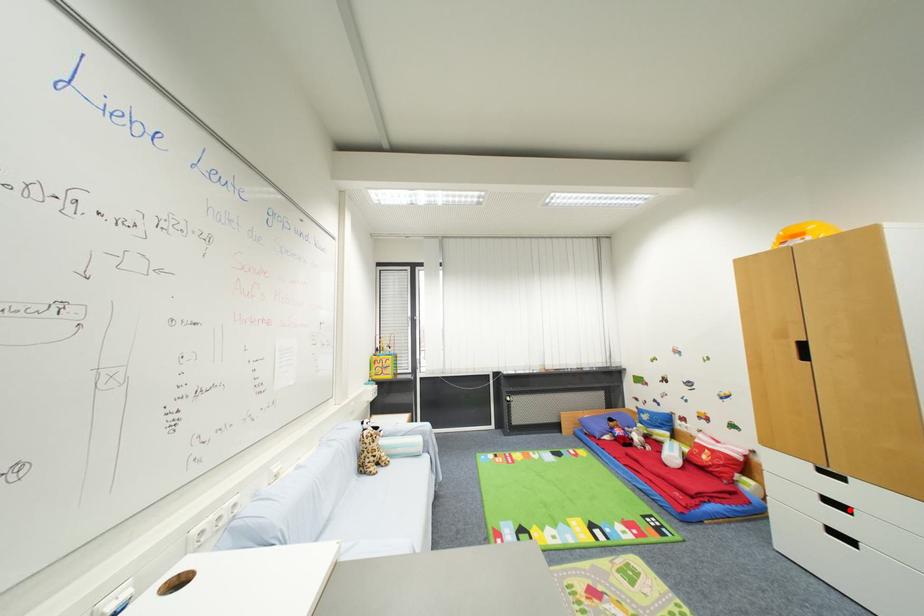
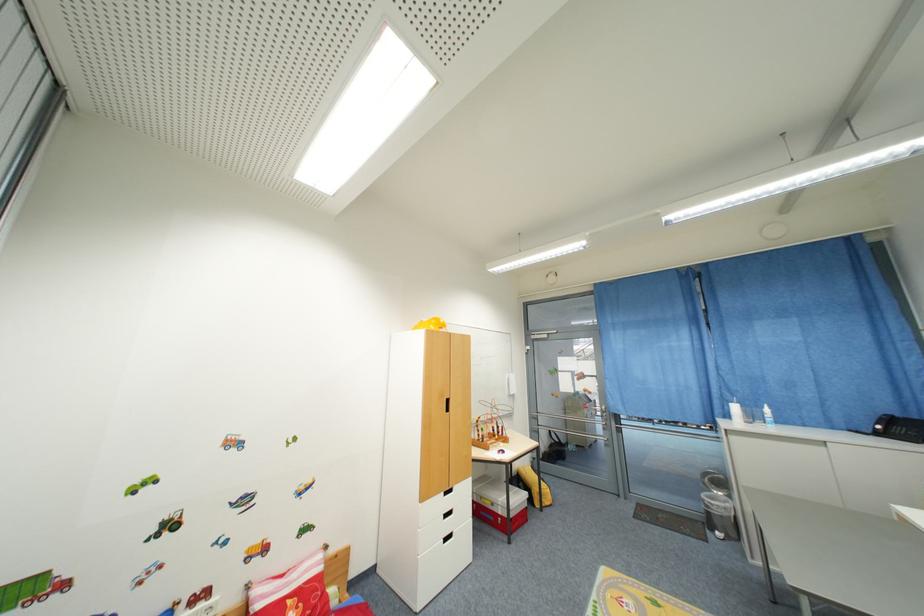
Question: I am providing you with two images of the same scene from different viewpoints. In image1, a red point is highlighted. Considering the same 3D point in image2, which of the following is correct?

Choices:
 (A) It is closer
 (B) It is farther

Answer: (B)